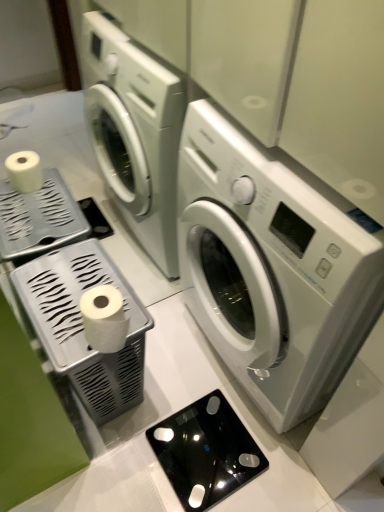
What do you see at coordinates (104, 318) in the screenshot? I see `white glossy toilet paper at lower left` at bounding box center [104, 318].

In order to face white glossy toilet paper at lower left, should I rotate leftwards or rightwards?

You should rotate left by 11.458 degrees.

What do you see at coordinates (83, 326) in the screenshot?
I see `white plastic tissue holder at left, arranged as the 1th appliance when viewed from the left` at bounding box center [83, 326].

Locate an element on the screen. Image resolution: width=384 pixels, height=512 pixels. white glossy washing machine at center is located at coordinates (273, 266).

In order to face black glass scale at lower center, placed as the 2th appliance when sorted from left to right, should I rotate leftwards or rightwards?

Turn right approximately 1.721 degrees to face it.

The width and height of the screenshot is (384, 512). What do you see at coordinates (206, 452) in the screenshot?
I see `black glass scale at lower center, the 1th appliance in the right-to-left sequence` at bounding box center [206, 452].

Find the location of a particular element. white glossy toilet paper at lower left is located at coordinates (104, 318).

Does white glossy washing machine at center have a lesser width compared to white glossy toilet paper at lower left?

No.

Is white glossy washing machine at center next to white glossy toilet paper at lower left?

No, white glossy washing machine at center is not next to white glossy toilet paper at lower left.

In the image, is white glossy washing machine at center positioned in front of or behind white glossy toilet paper at lower left?

white glossy washing machine at center is positioned closer to the viewer than white glossy toilet paper at lower left.

Identify the location of washing machine below the white glossy toilet paper at lower left (from a real-world perspective). (273, 266).

Consider the image. Could you tell me if white plastic tissue holder at left, arranged as the 1th appliance when viewed from the left, is turned towards white glossy washing machine at center?

Yes.

From a real-world perspective, is white plastic tissue holder at left, which is the 2th appliance from right to left, physically located above or below white glossy washing machine at center?

white plastic tissue holder at left, which is the 2th appliance from right to left, is below white glossy washing machine at center.

Find the location of a particular element. Image resolution: width=384 pixels, height=512 pixels. washing machine above the white plastic tissue holder at left, arranged as the 1th appliance when viewed from the left (from the image's perspective) is located at coordinates (273, 266).

Is white plastic tissue holder at left, arranged as the 1th appliance when viewed from the left, inside or outside of white glossy washing machine at center?

white plastic tissue holder at left, arranged as the 1th appliance when viewed from the left, is not inside white glossy washing machine at center, it's outside.

Would you say white glossy washing machine at center is outside white plastic tissue holder at left, arranged as the 1th appliance when viewed from the left?

Yes, white glossy washing machine at center is located beyond the bounds of white plastic tissue holder at left, arranged as the 1th appliance when viewed from the left.

From the white glossy washing machine at center, count the 2nd appliance to the left and point to it. Please provide its 2D coordinates.

[(83, 326)]

How different are the orientations of white glossy washing machine at center and white plastic tissue holder at left, which is the 2th appliance from right to left, in degrees?

white glossy washing machine at center and white plastic tissue holder at left, which is the 2th appliance from right to left, are facing 180 degrees away from each other.

Does white glossy washing machine at center come behind white plastic tissue holder at left, arranged as the 1th appliance when viewed from the left?

That is False.

Looking at this image, between white glossy toilet paper at lower left and white glossy washing machine at center, which one has less height?

With less height is white glossy toilet paper at lower left.

Considering the relative sizes of white glossy toilet paper at lower left and white glossy washing machine at center in the image provided, is white glossy toilet paper at lower left smaller than white glossy washing machine at center?

Yes, white glossy toilet paper at lower left is smaller than white glossy washing machine at center.

What's the angular difference between white glossy toilet paper at lower left and white glossy washing machine at center's facing directions?

The angular difference between white glossy toilet paper at lower left and white glossy washing machine at center is 180 degrees.

Is white glossy toilet paper at lower left oriented away from white glossy washing machine at center?

No, white glossy toilet paper at lower left's orientation is not away from white glossy washing machine at center.

Based on the photo, is black glass scale at lower center, placed as the 2th appliance when sorted from left to right, located within white glossy toilet paper at lower left?

No, black glass scale at lower center, placed as the 2th appliance when sorted from left to right, is not inside white glossy toilet paper at lower left.

Which point is more distant from viewer, (82, 303) or (172, 482)?

The point (172, 482) is more distant.

Locate an element on the screen. toilet paper on the left of black glass scale at lower center, placed as the 2th appliance when sorted from left to right is located at coordinates (104, 318).

Based on the photo, could you measure the distance between white glossy toilet paper at lower left and black glass scale at lower center, the 1th appliance in the right-to-left sequence?

white glossy toilet paper at lower left is 19.59 inches from black glass scale at lower center, the 1th appliance in the right-to-left sequence.

Based on their sizes in the image, would you say white glossy toilet paper at lower left is bigger or smaller than white plastic tissue holder at left, which is the 2th appliance from right to left?

white glossy toilet paper at lower left is smaller than white plastic tissue holder at left, which is the 2th appliance from right to left.

From the image's perspective, is white glossy toilet paper at lower left positioned above or below white plastic tissue holder at left, arranged as the 1th appliance when viewed from the left?

From the image's perspective, white glossy toilet paper at lower left appears above white plastic tissue holder at left, arranged as the 1th appliance when viewed from the left.

Consider the image. Does white glossy toilet paper at lower left have a lesser height compared to white plastic tissue holder at left, arranged as the 1th appliance when viewed from the left?

Yes.

Is white glossy toilet paper at lower left wider than white plastic tissue holder at left, which is the 2th appliance from right to left?

No, white glossy toilet paper at lower left is not wider than white plastic tissue holder at left, which is the 2th appliance from right to left.

Is black glass scale at lower center, placed as the 2th appliance when sorted from left to right, in contact with white plastic tissue holder at left, arranged as the 1th appliance when viewed from the left?

black glass scale at lower center, placed as the 2th appliance when sorted from left to right, and white plastic tissue holder at left, arranged as the 1th appliance when viewed from the left, are clearly separated.

Who is smaller, black glass scale at lower center, placed as the 2th appliance when sorted from left to right, or white plastic tissue holder at left, arranged as the 1th appliance when viewed from the left?

With smaller size is black glass scale at lower center, placed as the 2th appliance when sorted from left to right.

What's the angular difference between black glass scale at lower center, placed as the 2th appliance when sorted from left to right, and white plastic tissue holder at left, arranged as the 1th appliance when viewed from the left,'s facing directions?

black glass scale at lower center, placed as the 2th appliance when sorted from left to right, and white plastic tissue holder at left, arranged as the 1th appliance when viewed from the left, are facing 180 degrees away from each other.

Is black glass scale at lower center, placed as the 2th appliance when sorted from left to right, looking in the opposite direction of white plastic tissue holder at left, which is the 2th appliance from right to left?

black glass scale at lower center, placed as the 2th appliance when sorted from left to right, is not turned away from white plastic tissue holder at left, which is the 2th appliance from right to left.

Locate an element on the screen. washing machine located above the white glossy toilet paper at lower left (from the image's perspective) is located at coordinates (273, 266).

Where is `washing machine above the white plastic tissue holder at left, arranged as the 1th appliance when viewed from the left (from a real-world perspective)`? The height and width of the screenshot is (512, 384). washing machine above the white plastic tissue holder at left, arranged as the 1th appliance when viewed from the left (from a real-world perspective) is located at coordinates [273, 266].

When comparing their distances from white glossy toilet paper at lower left, does black glass scale at lower center, the 1th appliance in the right-to-left sequence, or white glossy washing machine at center seem further?

black glass scale at lower center, the 1th appliance in the right-to-left sequence.

Estimate the real-world distances between objects in this image. Which object is closer to black glass scale at lower center, placed as the 2th appliance when sorted from left to right, white glossy toilet paper at lower left or white plastic tissue holder at left, which is the 2th appliance from right to left?

The object closer to black glass scale at lower center, placed as the 2th appliance when sorted from left to right, is white plastic tissue holder at left, which is the 2th appliance from right to left.

Based on their spatial positions, is white plastic tissue holder at left, which is the 2th appliance from right to left, or white glossy washing machine at center closer to white glossy toilet paper at lower left?

white plastic tissue holder at left, which is the 2th appliance from right to left.

Looking at the image, which one is located further to white glossy washing machine at center, white glossy toilet paper at lower left or white plastic tissue holder at left, arranged as the 1th appliance when viewed from the left?

The object further to white glossy washing machine at center is white glossy toilet paper at lower left.

Consider the image. Considering their positions, is white plastic tissue holder at left, arranged as the 1th appliance when viewed from the left, positioned further to white glossy toilet paper at lower left than black glass scale at lower center, the 1th appliance in the right-to-left sequence?

Based on the image, black glass scale at lower center, the 1th appliance in the right-to-left sequence, appears to be further to white glossy toilet paper at lower left.

From the image, which object appears to be farther from white glossy toilet paper at lower left, white glossy washing machine at center or white plastic tissue holder at left, which is the 2th appliance from right to left?

white glossy washing machine at center lies further to white glossy toilet paper at lower left than the other object.

Based on their spatial positions, is white plastic tissue holder at left, which is the 2th appliance from right to left, or black glass scale at lower center, placed as the 2th appliance when sorted from left to right, further from white glossy washing machine at center?

The object further to white glossy washing machine at center is black glass scale at lower center, placed as the 2th appliance when sorted from left to right.

Looking at the image, which one is located further to black glass scale at lower center, the 1th appliance in the right-to-left sequence, white plastic tissue holder at left, arranged as the 1th appliance when viewed from the left, or white glossy toilet paper at lower left?

white glossy toilet paper at lower left lies further to black glass scale at lower center, the 1th appliance in the right-to-left sequence, than the other object.

This screenshot has width=384, height=512. Identify the location of toilet paper situated between white plastic tissue holder at left, which is the 2th appliance from right to left, and white glossy washing machine at center from left to right. (104, 318).

Where is `appliance between white glossy washing machine at center and black glass scale at lower center, placed as the 2th appliance when sorted from left to right, from top to bottom`? The width and height of the screenshot is (384, 512). appliance between white glossy washing machine at center and black glass scale at lower center, placed as the 2th appliance when sorted from left to right, from top to bottom is located at coordinates (83, 326).

Locate an element on the screen. This screenshot has width=384, height=512. appliance between white glossy toilet paper at lower left and black glass scale at lower center, placed as the 2th appliance when sorted from left to right, in the up-down direction is located at coordinates tap(83, 326).

Locate an element on the screen. toilet paper between white glossy washing machine at center and black glass scale at lower center, the 1th appliance in the right-to-left sequence, in the vertical direction is located at coordinates (104, 318).